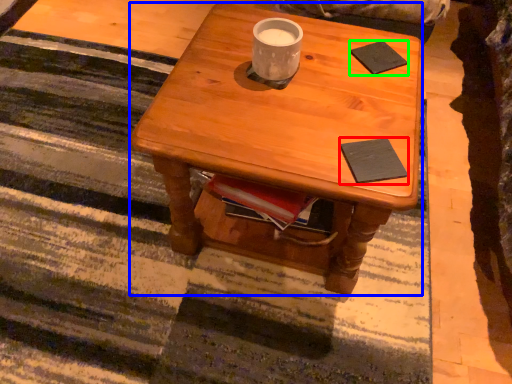
Question: Which is farther away from pad (highlighted by a red box)? desk (highlighted by a blue box) or pad (highlighted by a green box)?

Choices:
 (A) desk
 (B) pad

Answer: (B)